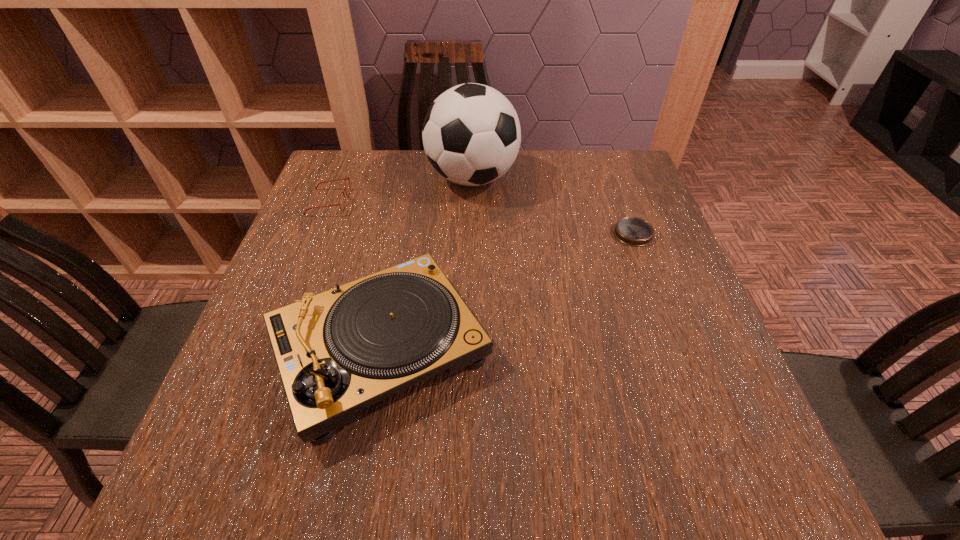
Select which object is the closest to the spectacles. Please provide its 2D coordinates. Your answer should be formatted as a tuple, i.e. [(x, y)], where the tuple contains the x and y coordinates of a point satisfying the conditions above.

[(471, 134)]

Locate which object ranks second in proximity to the nearest object. Please provide its 2D coordinates. Your answer should be formatted as a tuple, i.e. [(x, y)], where the tuple contains the x and y coordinates of a point satisfying the conditions above.

[(471, 134)]

The height and width of the screenshot is (540, 960). Identify the location of vacant space that satisfies the following two spatial constraints: 1. on the back side of the tallest object; 2. on the right side of the nearest object. (413, 178).

What are the coordinates of `blank area in the image that satisfies the following two spatial constraints: 1. on the face of the nearest object; 2. on the left side of the spectacles` in the screenshot? It's located at tap(270, 349).

I want to click on free space that satisfies the following two spatial constraints: 1. on the back side of the record player; 2. on the face of the third tallest object, so click(x=408, y=202).

In order to click on free location that satisfies the following two spatial constraints: 1. on the face of the third tallest object; 2. on the right side of the rightmost object in this screenshot , I will do `click(316, 234)`.

This screenshot has width=960, height=540. Identify the location of free space that satisfies the following two spatial constraints: 1. on the face of the nearest object; 2. on the right side of the spectacles. (270, 349).

Where is `vacant space that satisfies the following two spatial constraints: 1. on the face of the spectacles; 2. on the left side of the compass`? The image size is (960, 540). vacant space that satisfies the following two spatial constraints: 1. on the face of the spectacles; 2. on the left side of the compass is located at coordinates (316, 234).

Identify the location of vacant area in the image that satisfies the following two spatial constraints: 1. on the front side of the soccer ball; 2. on the left side of the shortest object. Image resolution: width=960 pixels, height=540 pixels. point(471,234).

Identify the location of free location that satisfies the following two spatial constraints: 1. on the back side of the rightmost object; 2. on the right side of the third shortest object. (402, 234).